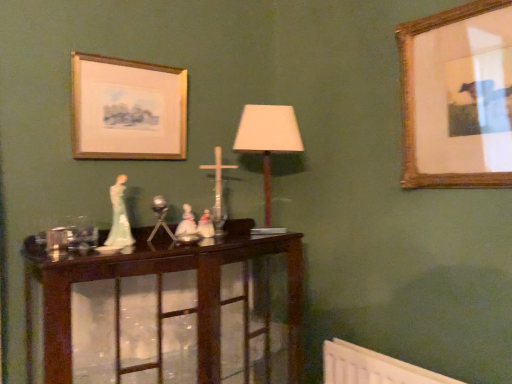
Identify the location of free space in front of matte white shade at center. The height and width of the screenshot is (384, 512). (254, 239).